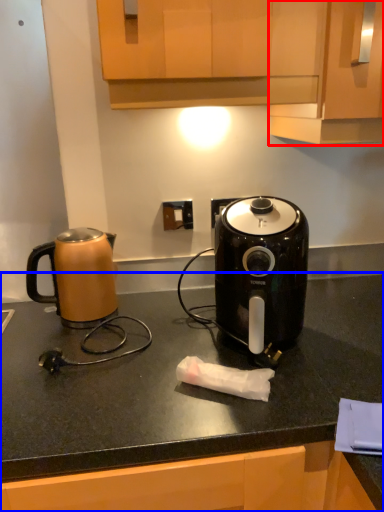
Question: Among these objects, which one is nearest to the camera, cabinetry (highlighted by a red box) or countertop (highlighted by a blue box)?

Choices:
 (A) cabinetry
 (B) countertop

Answer: (B)